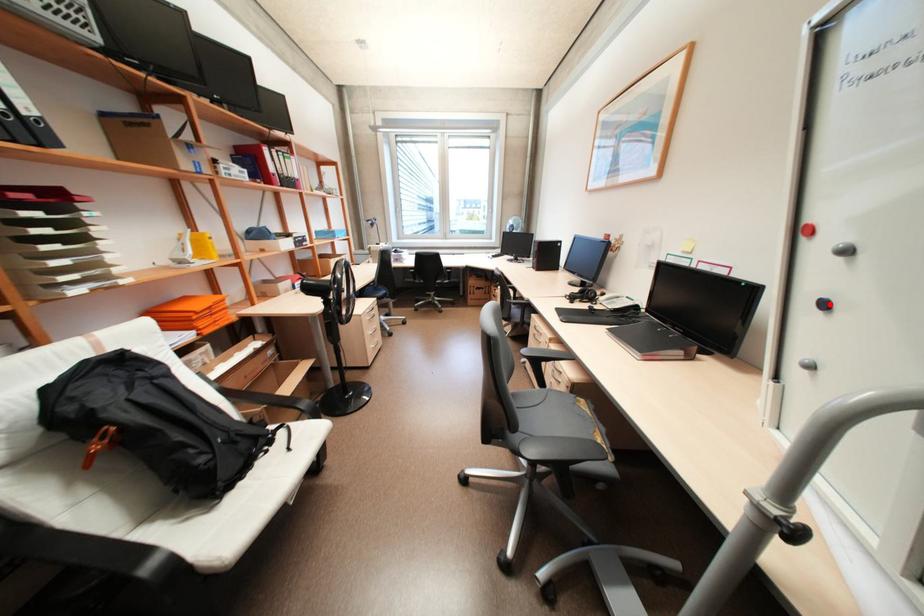
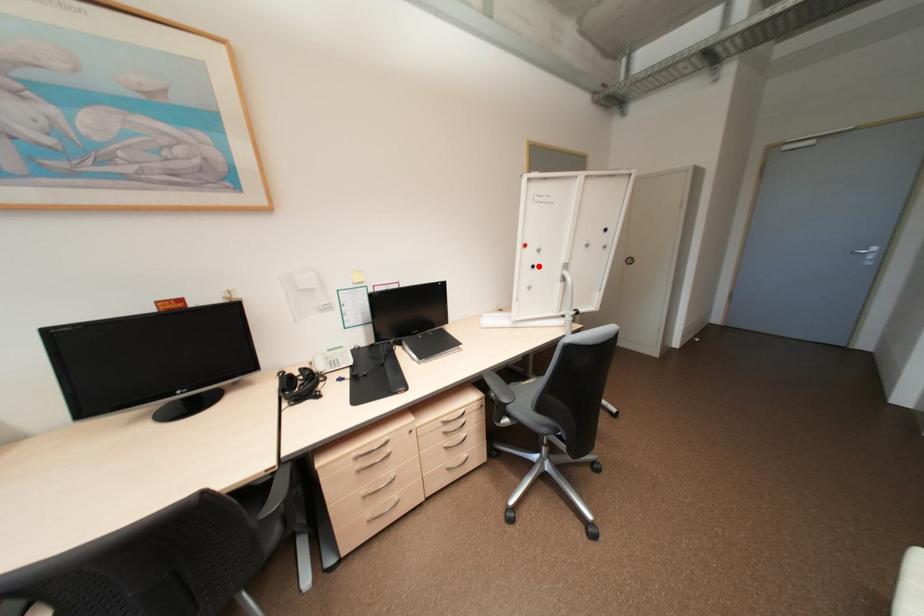
I am providing you with two images of the same scene from different viewpoints. A red point is marked on the first image and another point is marked on the second image. Does the point marked in image1 correspond to the same location as the one in image2?

Yes